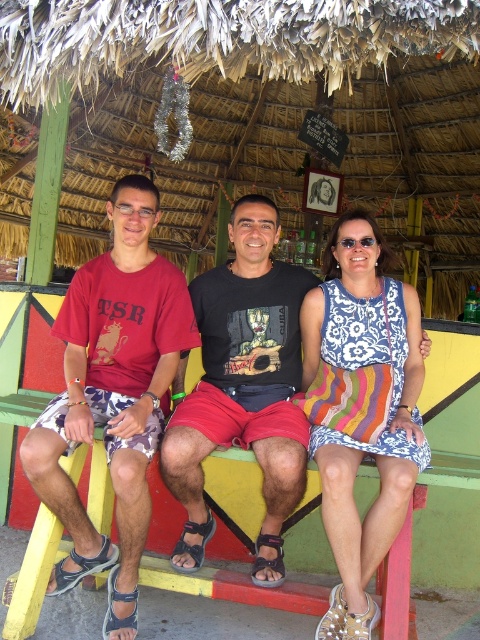
You are standing in front of the bench where three people are sitting. You want to place a small gift on the bench. The gift can only be placed at one of two specific points on the bench. The first point is at coordinate point[133,300] and the second point is at point[303,328]. Which point is closer to you so that you can easily reach it without disturbing the people sitting?

Point[133,300] is closer to the viewer than point[303,328], so placing the gift there would be easier to reach without disturbing the people sitting.